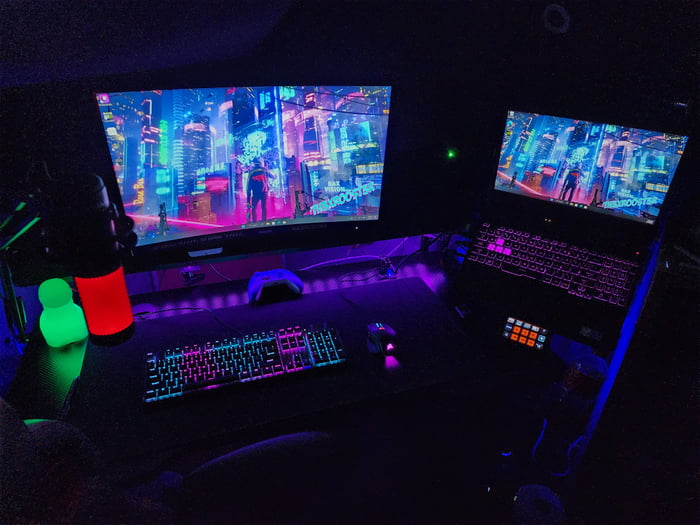
The width and height of the screenshot is (700, 525). In order to click on laptop keyoard in this screenshot , I will do `click(545, 273)`.